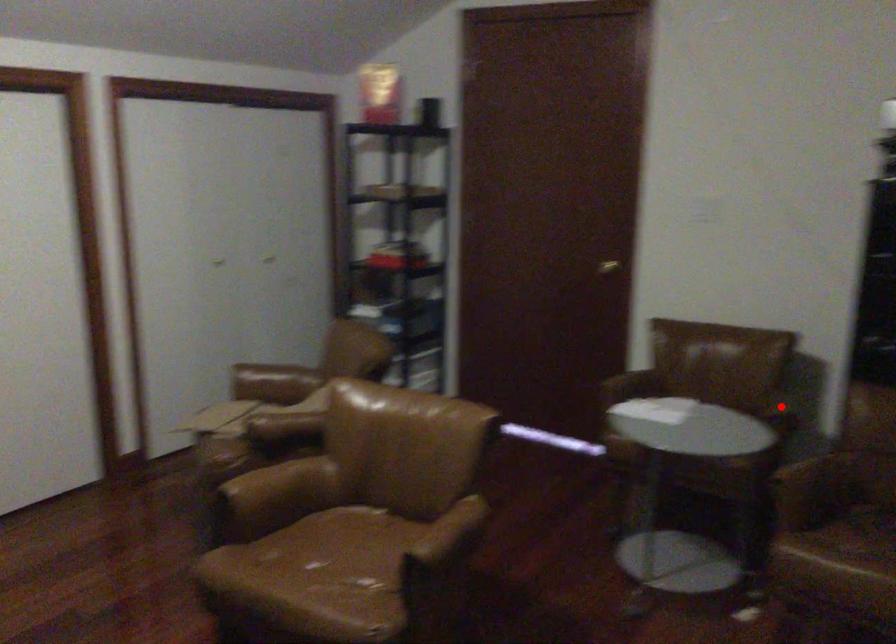
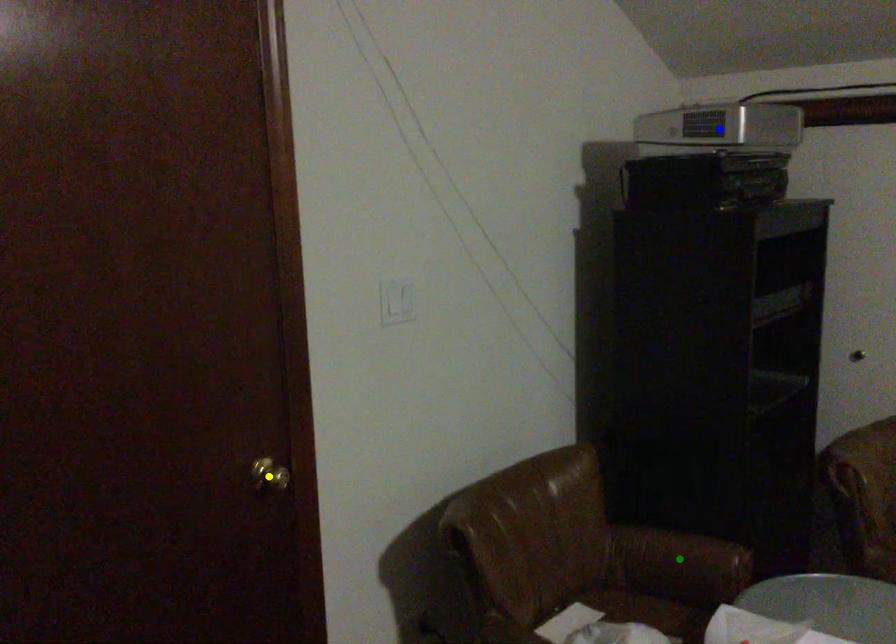
Question: I am providing you with two images of the same scene from different viewpoints. A red point is marked on the first image. You are given multiple points on the second image. In image 2, which mark is for the same physical point as the one in image 1?

Choices:
 (A) green point
 (B) blue point
 (C) yellow point

Answer: (A)